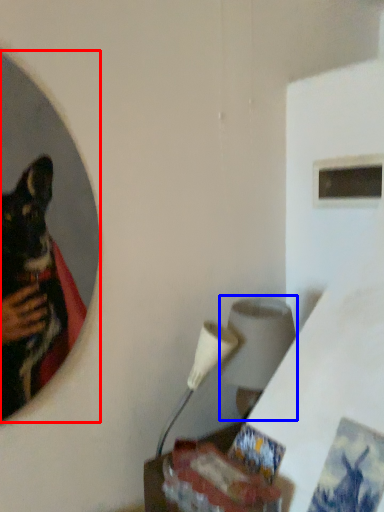
Question: Which point is closer to the camera, mirror (highlighted by a red box) or lamp (highlighted by a blue box)?

Choices:
 (A) mirror
 (B) lamp

Answer: (A)